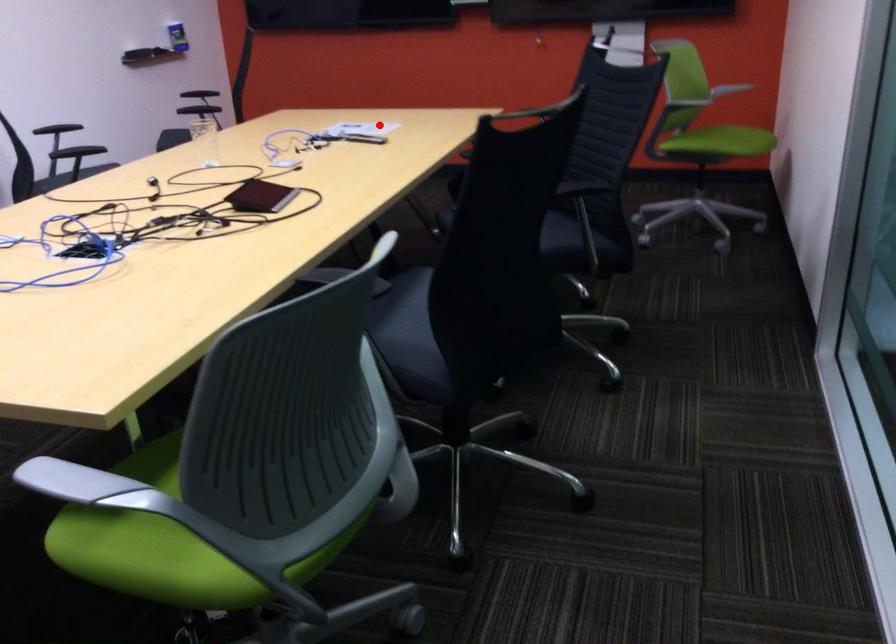
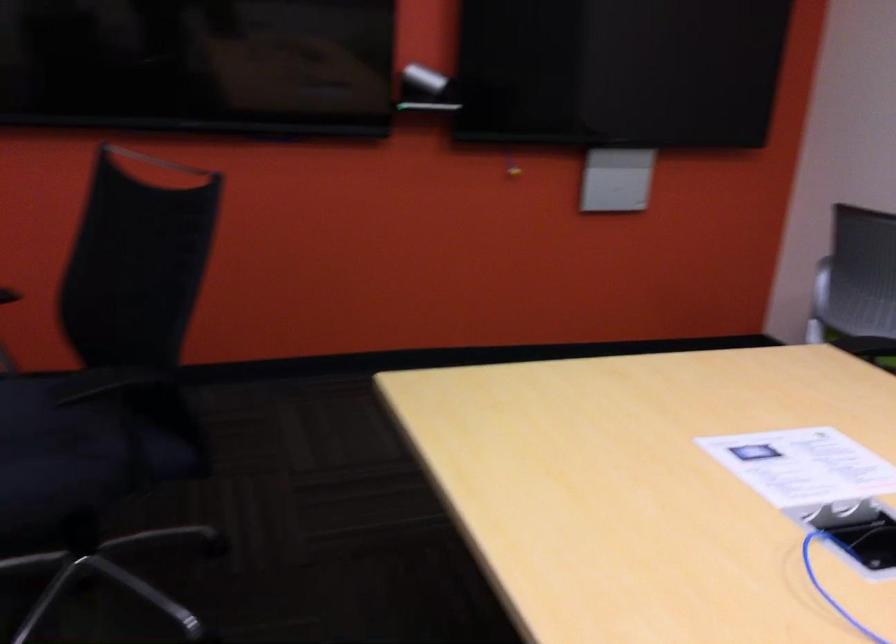
Where in the second image is the point corresponding to the highlighted location from the first image?

(803, 466)